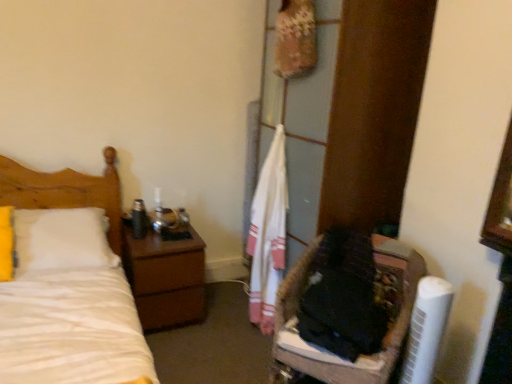
Question: From a real-world perspective, relative to fuzzy fabric basket at lower right, is white plastic air conditioner at lower right vertically above or below?

Choices:
 (A) below
 (B) above

Answer: (B)

Question: Is white plastic air conditioner at lower right inside or outside of fuzzy fabric basket at lower right?

Choices:
 (A) inside
 (B) outside

Answer: (A)

Question: Estimate the real-world distances between objects in this image. Which object is farther from the white cotton towel at center?

Choices:
 (A) fuzzy fabric basket at lower right
 (B) white plastic air conditioner at lower right
 (C) brown wood nightstand at left
 (D) white matte bed at left

Answer: (D)

Question: Which is farther from the white plastic air conditioner at lower right?

Choices:
 (A) fuzzy fabric basket at lower right
 (B) white matte bed at left
 (C) brown wood nightstand at left
 (D) white cotton towel at center

Answer: (B)